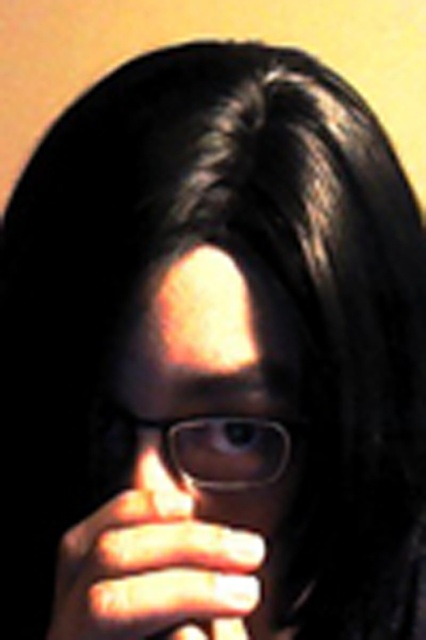
You are a photographer adjusting lighting for a portrait. You notice the subject has matte black glasses at center and a translucent glass nose at center. Which object will reflect more light and why?

The matte black glasses at center will reflect more light because they are in front of the translucent glass nose at center, making their surface properties more visible under the lighting setup.

Consider the image. You are an artist trying to sketch the scene. You notice the satin white hand at center and the transparent plastic glasses at center. Which object is located below the other?

The satin white hand at center is positioned under transparent plastic glasses at center, so the hand is below the glasses.

You are an artist trying to sketch the scene. You need to place the matte black glasses at center in your drawing. Where exactly should you position them using the coordinate system provided?

You should position the matte black glasses at center at the coordinate point of (219, 403) as specified in the description.